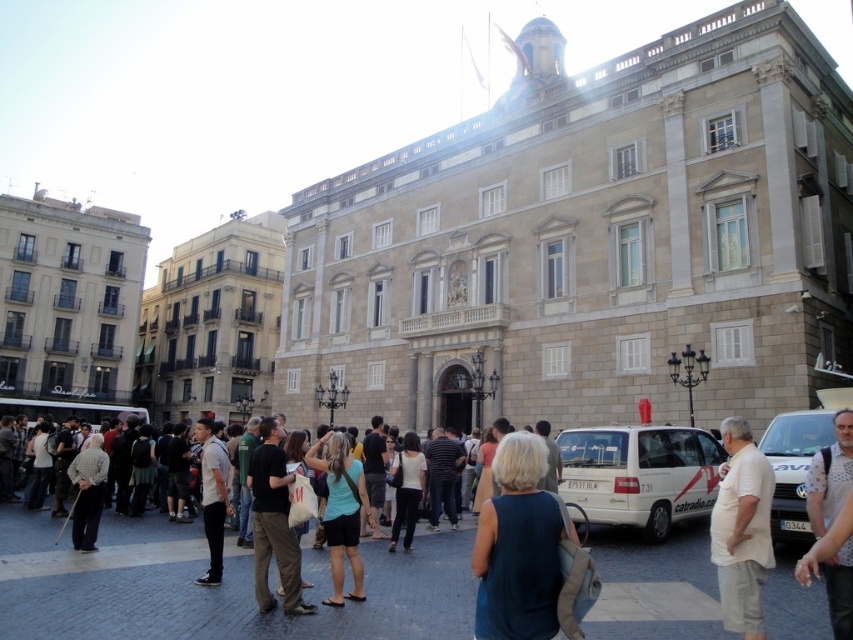
Which is more to the right, white matte van at center or white matte van at lower right?

Positioned to the right is white matte van at lower right.

Which is more to the left, white matte van at center or white matte van at lower right?

white matte van at center

Is point (592, 497) less distant than point (820, 442)?

No, (592, 497) is behind (820, 442).

The height and width of the screenshot is (640, 853). I want to click on white matte van at center, so click(x=640, y=474).

Is dark blue sleeveless top at center taller than beige cotton shirt at lower right?

No.

Is dark blue sleeveless top at center thinner than beige cotton shirt at lower right?

Correct, dark blue sleeveless top at center's width is less than beige cotton shirt at lower right's.

What do you see at coordinates (518, 547) in the screenshot? The height and width of the screenshot is (640, 853). I see `dark blue sleeveless top at center` at bounding box center [518, 547].

You are a GUI agent. You are given a task and a screenshot of the screen. Output one action in this format:
    pyautogui.click(x=<x>, y=<y>)
    Task: Click on the dark blue sleeveless top at center
    
    Given the screenshot: What is the action you would take?
    pyautogui.click(x=518, y=547)

Who is positioned more to the right, dark brown leather pants at center or light blue shirt at center?

From the viewer's perspective, dark brown leather pants at center appears more on the right side.

Is dark brown leather pants at center below light blue shirt at center?

No, dark brown leather pants at center is not below light blue shirt at center.

Between point (291, 564) and point (207, 442), which one is positioned in front?

Point (291, 564)

In order to click on dark brown leather pants at center in this screenshot , I will do `click(273, 522)`.